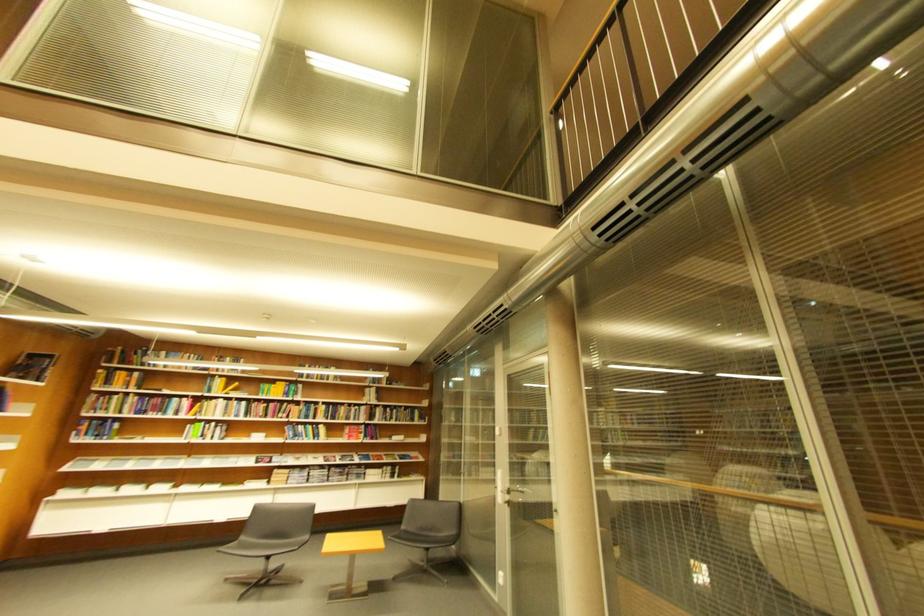
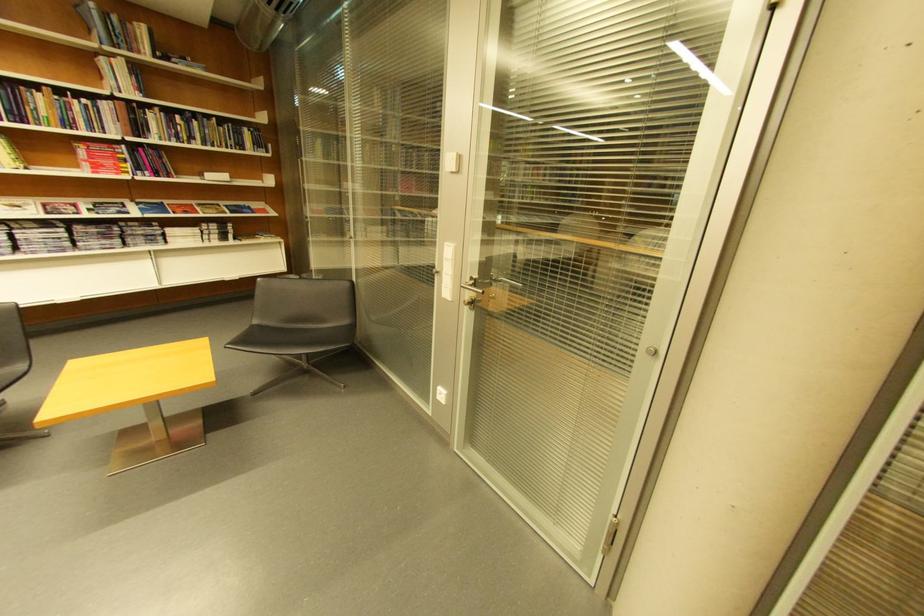
The point at (351, 416) is marked in the first image. Where is the corresponding point in the second image?

(54, 116)